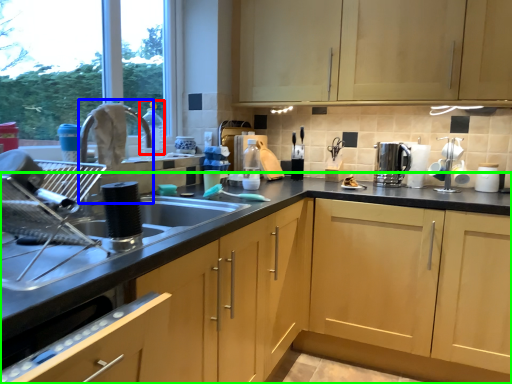
Question: Which is farther away from bottle (highlighted by a red box)? faucet (highlighted by a blue box) or cabinetry (highlighted by a green box)?

Choices:
 (A) faucet
 (B) cabinetry

Answer: (B)